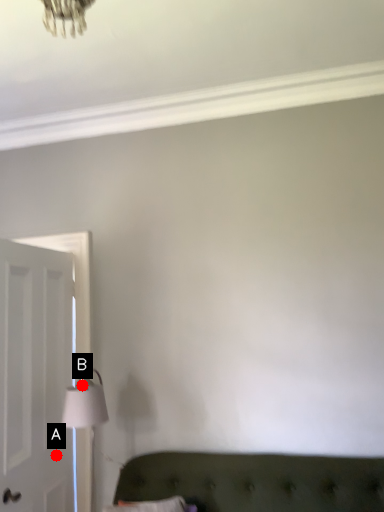
Question: Two points are circled on the image, labeled by A and B beside each circle. Which point is closer to the camera taking this photo?

Choices:
 (A) A is closer
 (B) B is closer

Answer: (B)